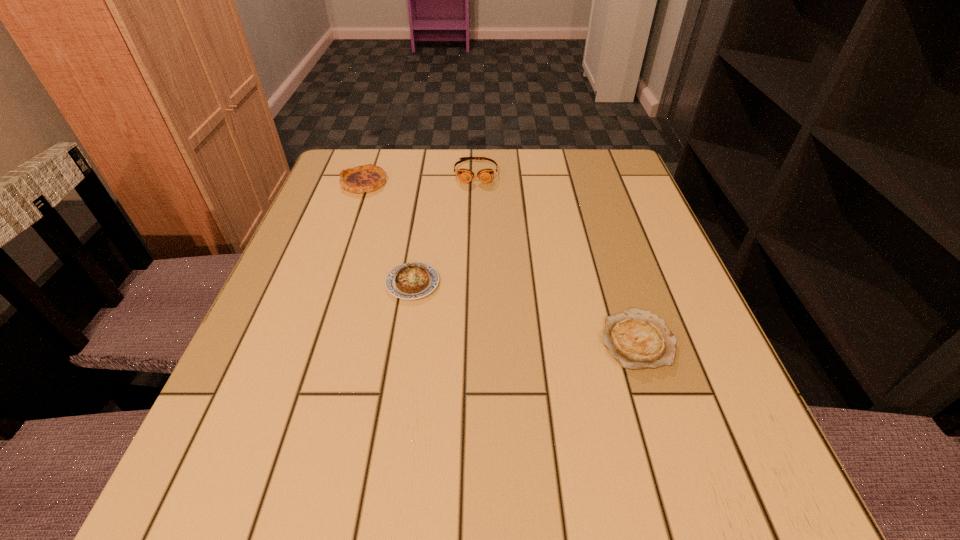
Locate an element on the screen. Image resolution: width=960 pixels, height=540 pixels. the tallest object is located at coordinates (485, 175).

Image resolution: width=960 pixels, height=540 pixels. Find the location of `the third object from left to right`. the third object from left to right is located at coordinates (485, 175).

You are a GUI agent. You are given a task and a screenshot of the screen. Output one action in this format:
    pyautogui.click(x=<x>, y=<y>)
    Task: Click on the tallest quiche
    
    Given the screenshot: What is the action you would take?
    pyautogui.click(x=366, y=178)

Locate an element on the screen. the leftmost object is located at coordinates (366, 178).

This screenshot has width=960, height=540. Find the location of `the third object from right to left`. the third object from right to left is located at coordinates (414, 280).

Find the location of a particular element. the second nearest object is located at coordinates tap(414, 280).

Where is `the rightmost object`? the rightmost object is located at coordinates [x=637, y=339].

Locate an element on the screen. the nearest object is located at coordinates (637, 339).

Find the location of a particular element. blank area located 0.220m with the lenses facing forward on the goggles is located at coordinates (475, 241).

The width and height of the screenshot is (960, 540). Find the location of `vacant space located 0.360m on the front of the leftmost quiche`. vacant space located 0.360m on the front of the leftmost quiche is located at coordinates (321, 306).